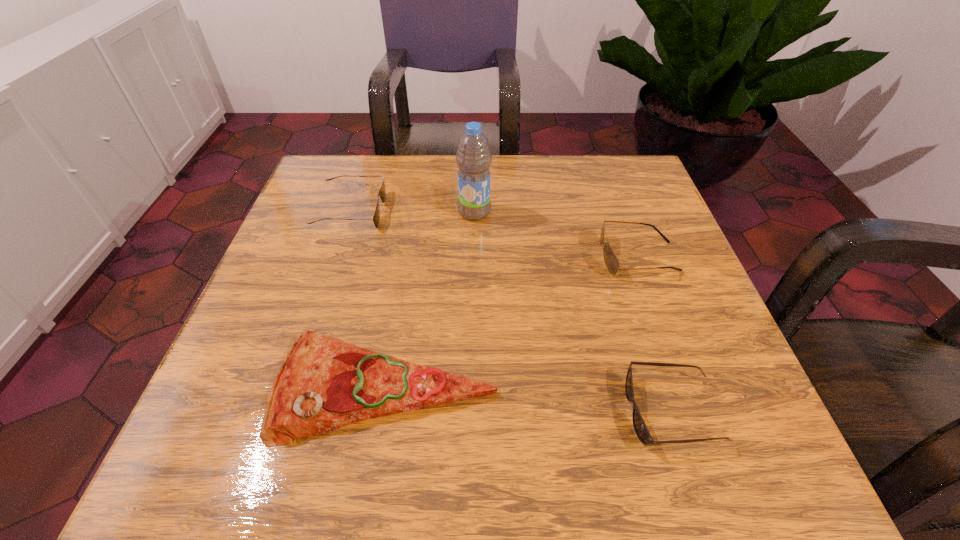
You are a GUI agent. You are given a task and a screenshot of the screen. Output one action in this format:
    pyautogui.click(x=<x>, y=<y>)
    Task: Click on the vacant space located on the front-facing side of the tallest sunglasses
    The width and height of the screenshot is (960, 540).
    Given the screenshot: What is the action you would take?
    pyautogui.click(x=522, y=256)

Where is `blank area located 0.260m on the front-facing side of the second shortest sunglasses`? The image size is (960, 540). blank area located 0.260m on the front-facing side of the second shortest sunglasses is located at coordinates (495, 211).

Identify the location of free space located on the back of the pizza. (406, 269).

Identify the location of vacant space positioned on the lenses of the nearest sunglasses. The width and height of the screenshot is (960, 540). (423, 411).

The height and width of the screenshot is (540, 960). What are the coordinates of `vacant space located on the lenses of the nearest sunglasses` in the screenshot? It's located at (503, 411).

In order to click on vacant space located on the lenses of the nearest sunglasses in this screenshot , I will do `click(522, 411)`.

Where is `water bottle located in the far edge section of the desktop`? water bottle located in the far edge section of the desktop is located at coordinates (473, 157).

Where is `sunglasses that is at the far edge`? Image resolution: width=960 pixels, height=540 pixels. sunglasses that is at the far edge is located at coordinates (382, 192).

In order to click on pizza positioned at the near edge in this screenshot , I will do `click(324, 383)`.

Where is `sunglasses present at the near edge`? The image size is (960, 540). sunglasses present at the near edge is located at coordinates (640, 427).